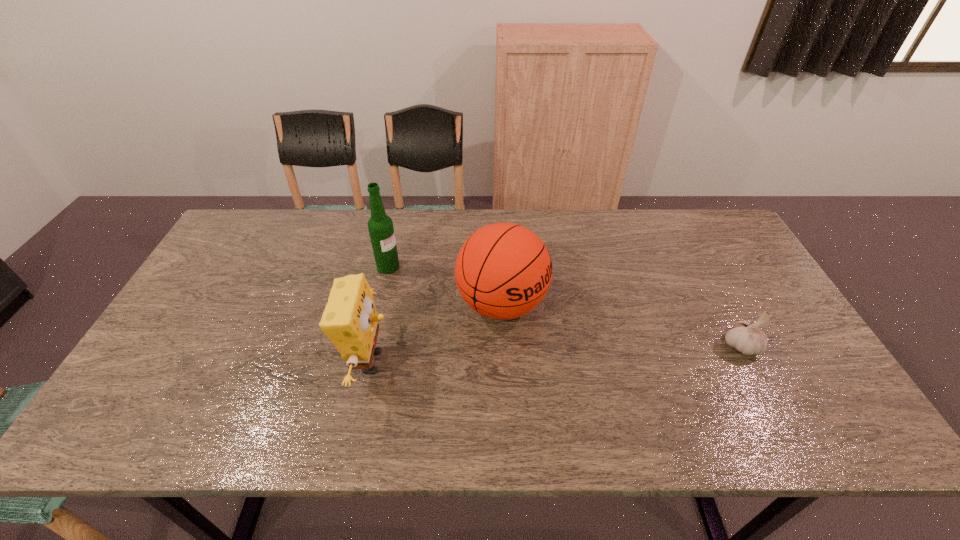
The height and width of the screenshot is (540, 960). In order to click on vacant region located 0.390m on the label of the beer bottle in this screenshot , I will do (511, 319).

The height and width of the screenshot is (540, 960). I want to click on vacant space located on the label of the beer bottle, so [x=469, y=301].

Locate an element on the screen. vacant area situated 0.130m on the label of the beer bottle is located at coordinates (432, 286).

At what (x,y) coordinates should I click in order to perform the action: click on object that is at the near edge. Please return your answer as a coordinate pair (x, y). Image resolution: width=960 pixels, height=540 pixels. Looking at the image, I should click on (350, 320).

Image resolution: width=960 pixels, height=540 pixels. I want to click on object that is at the right edge, so click(x=747, y=338).

Locate an element on the screen. Image resolution: width=960 pixels, height=540 pixels. vacant space at the far edge is located at coordinates (360, 249).

In the image, there is a desktop. Where is `free space at the near edge`? This screenshot has height=540, width=960. free space at the near edge is located at coordinates (518, 384).

You are a GUI agent. You are given a task and a screenshot of the screen. Output one action in this format:
    pyautogui.click(x=<x>, y=<y>)
    Task: Click on the free space at the left edge
    The width and height of the screenshot is (960, 540).
    Given the screenshot: What is the action you would take?
    pyautogui.click(x=210, y=272)

Identify the location of vacant point at the far left corner. Image resolution: width=960 pixels, height=540 pixels. (253, 212).

Identify the location of vacant space at the far right corner. (685, 221).